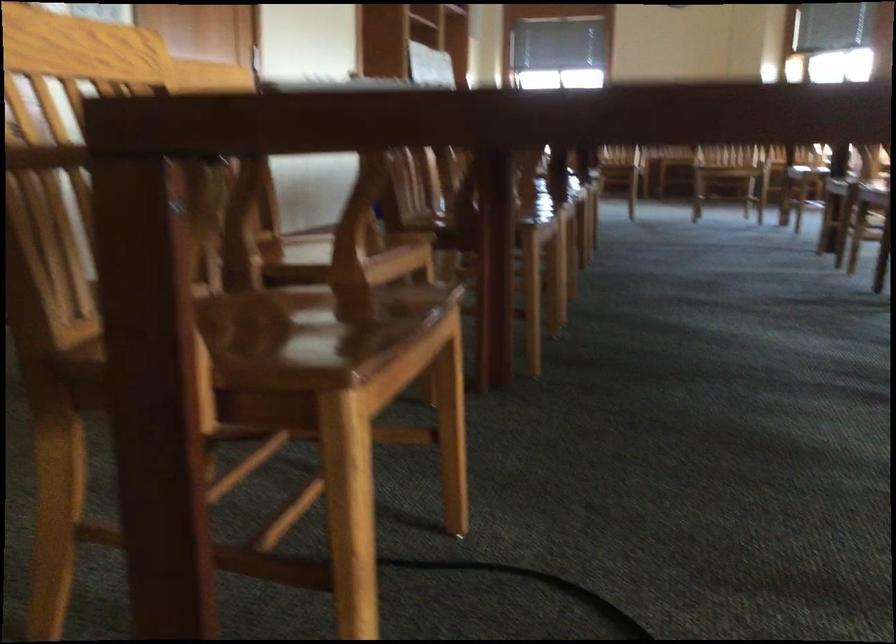
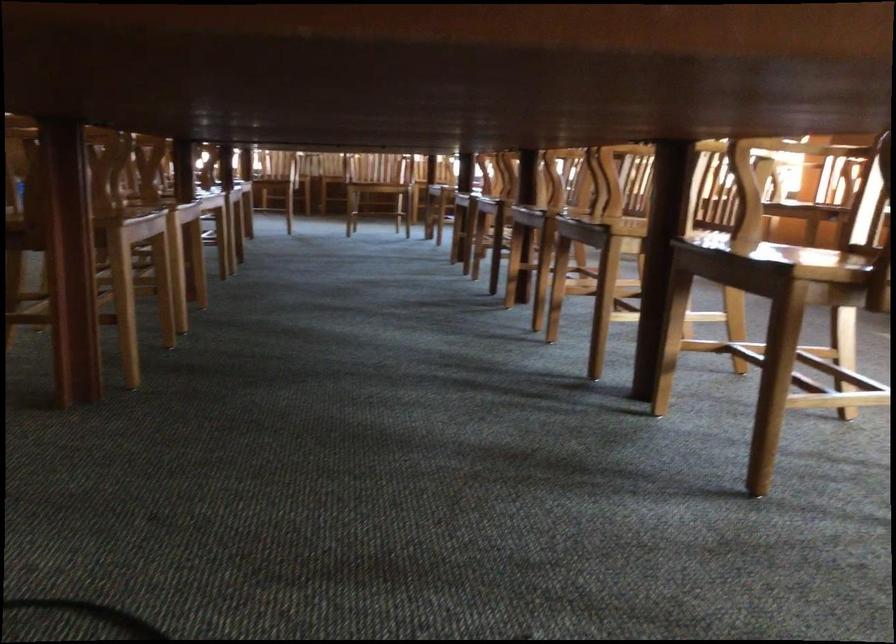
In the second image, find the point that corresponds to (x=504, y=219) in the first image.

(80, 223)